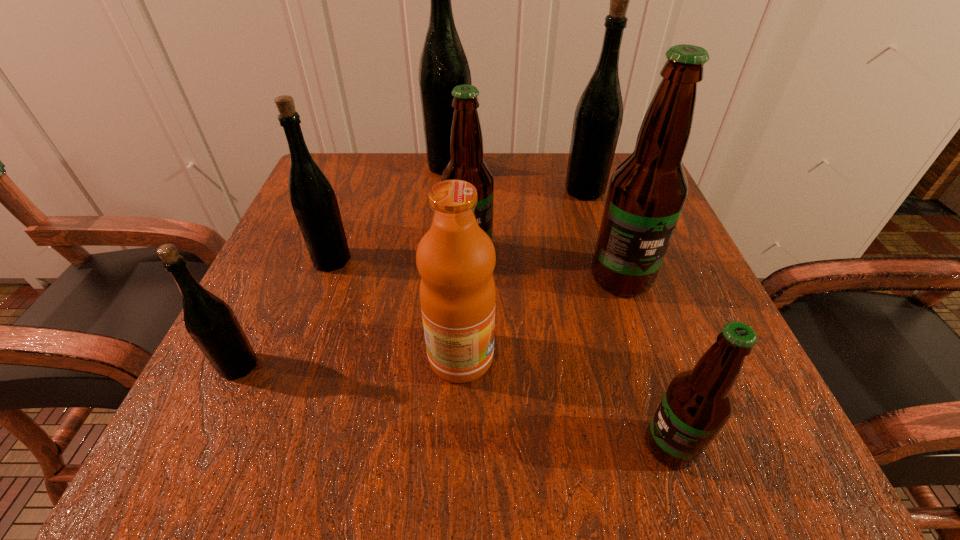
In the image, there is a desktop. Find the location of `vacant space at the near left corner`. vacant space at the near left corner is located at coordinates (228, 439).

Locate an element on the screen. Image resolution: width=960 pixels, height=540 pixels. blank region between the biggest brown beer bottle and the second green beer bottle from right to left is located at coordinates (536, 222).

Where is `free space between the second green beer bottle from left to right and the nearest object`? This screenshot has height=540, width=960. free space between the second green beer bottle from left to right and the nearest object is located at coordinates (501, 353).

I want to click on free spot between the leftmost beer bottle and the third nearest green beer bottle, so click(412, 279).

The image size is (960, 540). In order to click on vacant area that lies between the smallest brown beer bottle and the biggest brown beer bottle in this screenshot , I will do `click(646, 362)`.

At what (x,y) coordinates should I click in order to perform the action: click on free space between the second farthest beer bottle and the fruit juice. Please return your answer as a coordinate pair (x, y). Image resolution: width=960 pixels, height=540 pixels. Looking at the image, I should click on click(x=522, y=274).

This screenshot has width=960, height=540. I want to click on the third closest object to the biggest brown beer bottle, so click(x=455, y=258).

Point out which object is positioned as the fifth nearest to the fruit juice. Please provide its 2D coordinates. Your answer should be formatted as a tuple, i.e. [(x, y)], where the tuple contains the x and y coordinates of a point satisfying the conditions above.

[(212, 324)]

Select which beer bottle is the fourth closest to the second farthest green beer bottle. Please provide its 2D coordinates. Your answer should be formatted as a tuple, i.e. [(x, y)], where the tuple contains the x and y coordinates of a point satisfying the conditions above.

[(313, 200)]

Locate which beer bottle is the fifth closest to the smallest green beer bottle. Please provide its 2D coordinates. Your answer should be formatted as a tuple, i.e. [(x, y)], where the tuple contains the x and y coordinates of a point satisfying the conditions above.

[(698, 402)]